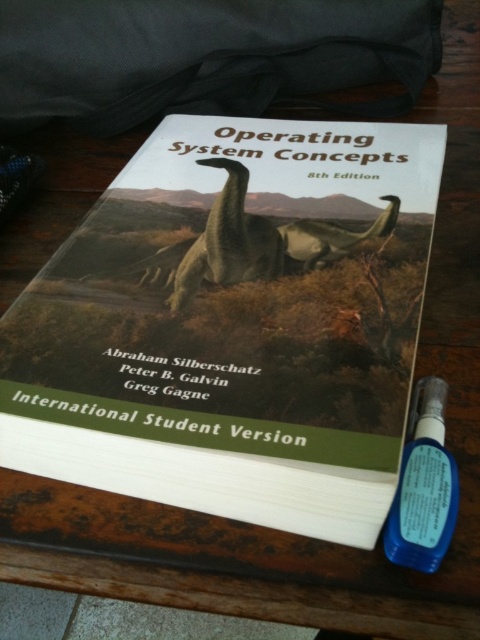
Does hardcover book at center appear over green matte dinosaur at center?

Incorrect, hardcover book at center is not positioned above green matte dinosaur at center.

Image resolution: width=480 pixels, height=640 pixels. What do you see at coordinates (233, 324) in the screenshot? I see `hardcover book at center` at bounding box center [233, 324].

I want to click on hardcover book at center, so point(233,324).

You are a GUI agent. You are given a task and a screenshot of the screen. Output one action in this format:
    pyautogui.click(x=<x>, y=<y>)
    Task: Click on the hardcover book at center
    The image size is (480, 640).
    Given the screenshot: What is the action you would take?
    pyautogui.click(x=233, y=324)